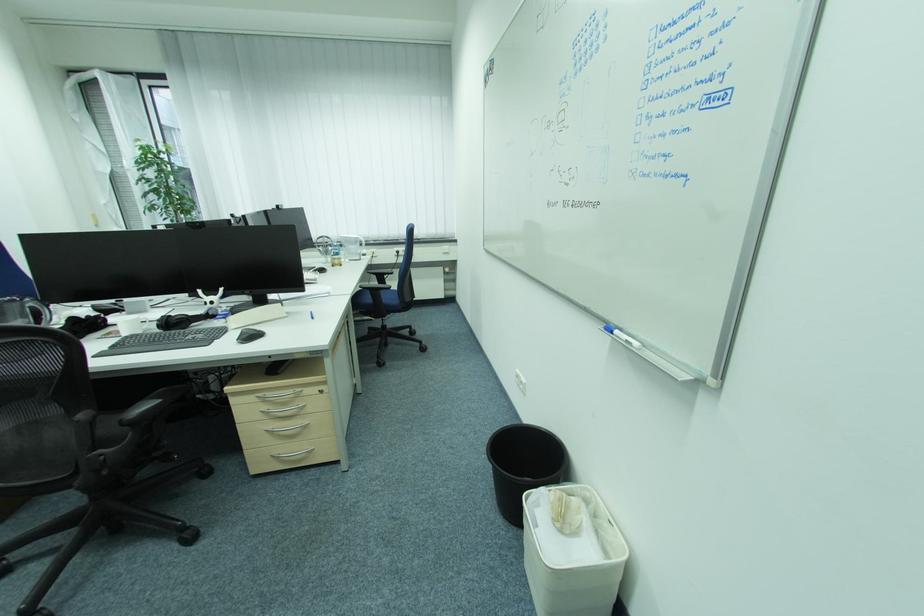
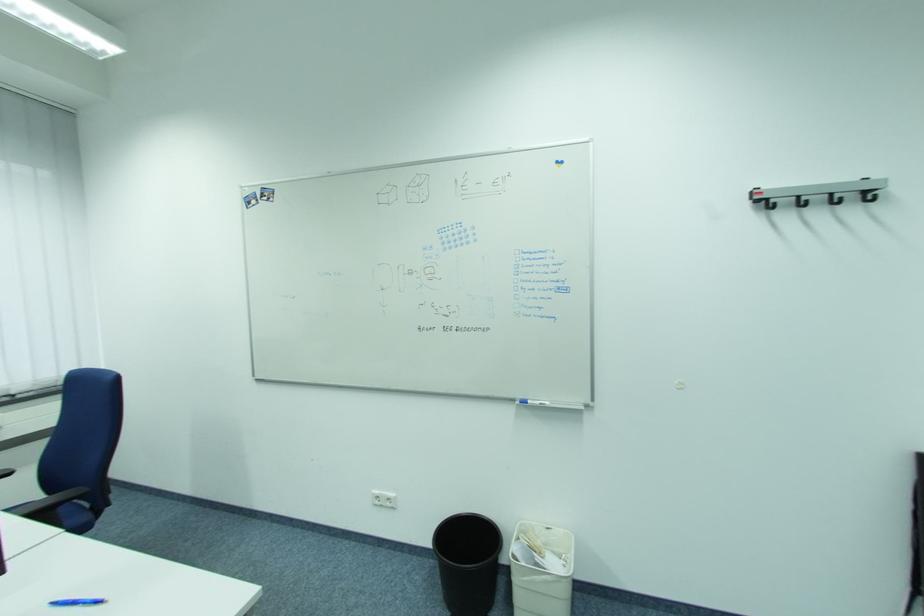
The point at (528,383) is marked in the first image. Where is the corresponding point in the second image?

(395, 500)